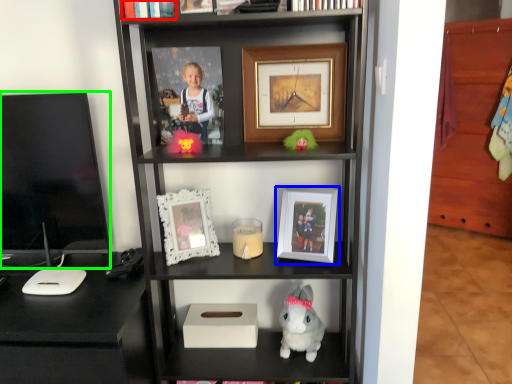
Question: Which object is the closest to the book (highlighted by a red box)? Choose among these: picture frame (highlighted by a blue box) or television (highlighted by a green box).

Choices:
 (A) picture frame
 (B) television

Answer: (B)